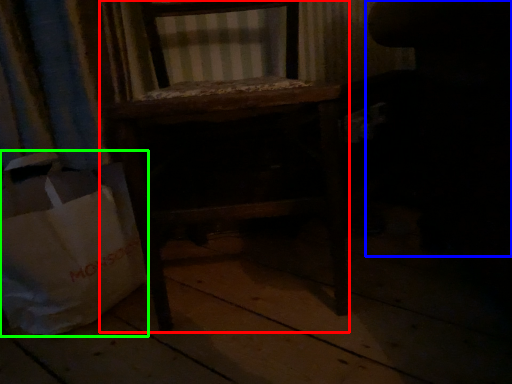
Question: Based on their relative distances, which object is nearer to furniture (highlighted by a red box)? Choose from swivel chair (highlighted by a blue box) and grocery bag (highlighted by a green box).

Choices:
 (A) swivel chair
 (B) grocery bag

Answer: (B)